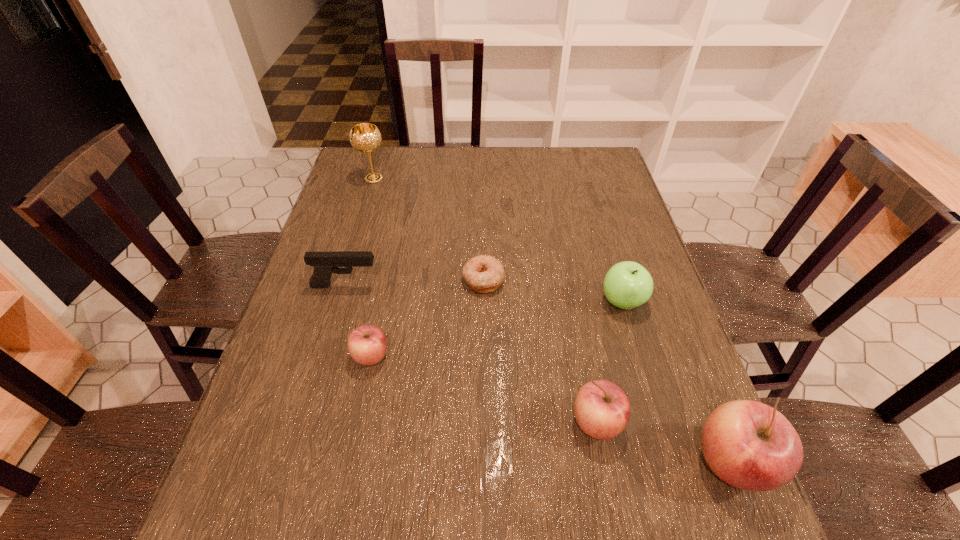
Point out which apple is positioned as the third nearest to the leftmost apple. Please provide its 2D coordinates. Your answer should be formatted as a tuple, i.e. [(x, y)], where the tuple contains the x and y coordinates of a point satisfying the conditions above.

[(749, 445)]

At what (x,y) coordinates should I click in order to perform the action: click on vacant area in the image that satisfies the following two spatial constraints: 1. on the front-facing side of the tallest apple; 2. on the right side of the pistol. Please return your answer as a coordinate pair (x, y). Image resolution: width=960 pixels, height=540 pixels. Looking at the image, I should click on (295, 463).

Identify the location of free point that satisfies the following two spatial constraints: 1. on the front side of the chalice; 2. on the left side of the farthest apple. (337, 302).

Find the location of a particular element. free space that satisfies the following two spatial constraints: 1. on the front-facing side of the second apple from left to right; 2. on the left side of the pistol is located at coordinates (306, 423).